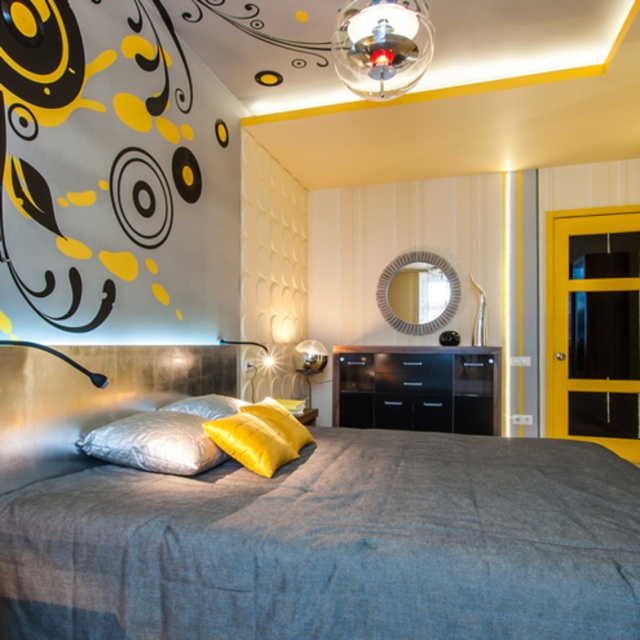
You are standing in the bedroom and want to place a new picture frame on the wall. You have two options for placement. The first option is above the black glossy dresser at center, and the second option is next to the yellow satin pillow at center. Which location is higher up?

The yellow satin pillow at center is higher up than the black glossy dresser at center because the black glossy dresser at center is below the yellow satin pillow at center.